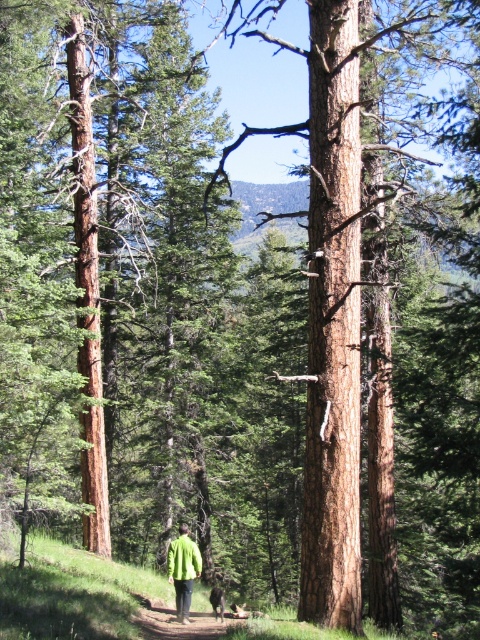
You are a hiker who wants to place a GPS marker exactly where the green matte jacket at center is located. According to the coordinates provided, what are the coordinates you should input into your GPS device?

The coordinates for the green matte jacket at center are at point (182,570).

You are a photographer standing at the edge of the forest. You want to take a photo of the green fuzzy jacket at lower center and the brown fur dog at center. Which object should you focus on first if you want both to be in sharp focus?

You should focus on the green fuzzy jacket at lower center first because it is closer to the viewer than the brown fur dog at center. By focusing on the closer object, the depth of field may extend to include the farther object as well, ensuring both are in focus.